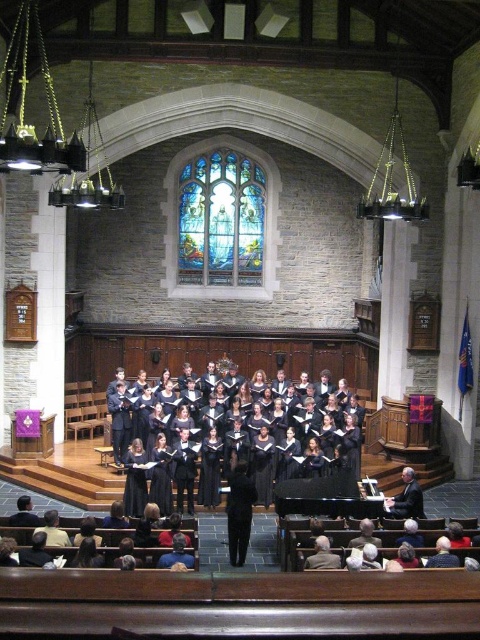
Question: Where is black velvet choir at center located in relation to black smooth conductor at center in the image?

Choices:
 (A) left
 (B) right

Answer: (A)

Question: Among these points, which one is nearest to the camera?

Choices:
 (A) (407, 484)
 (B) (244, 182)

Answer: (A)

Question: Is stained glass window at center wider than black smooth conductor at center?

Choices:
 (A) no
 (B) yes

Answer: (A)

Question: Based on their relative distances, which object is nearer to the stained glass window at center?

Choices:
 (A) black velvet choir at center
 (B) black smooth conductor at center

Answer: (A)

Question: Does black velvet choir at center appear on the right side of black smooth conductor at center?

Choices:
 (A) no
 (B) yes

Answer: (A)

Question: Estimate the real-world distances between objects in this image. Which object is closer to the black velvet choir at center?

Choices:
 (A) stained glass window at center
 (B) black smooth conductor at center

Answer: (B)